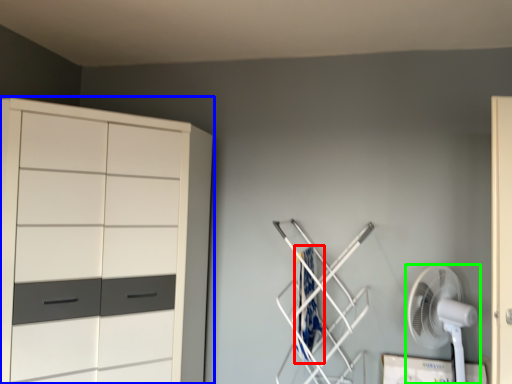
Question: Which object is positioned closest to laundry (highlighted by a red box)? Select from cupboard (highlighted by a blue box) and mechanical fan (highlighted by a green box).

Choices:
 (A) cupboard
 (B) mechanical fan

Answer: (B)